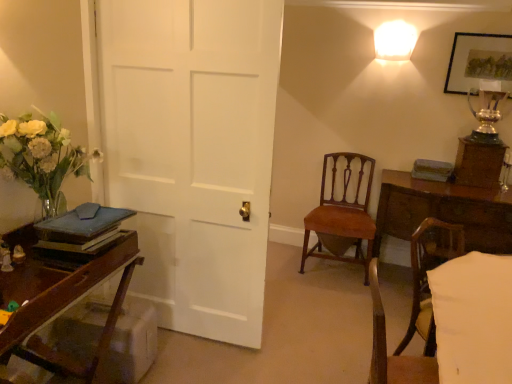
I want to click on free spot above wooden picture frame at upper right (from a real-world perspective), so click(485, 38).